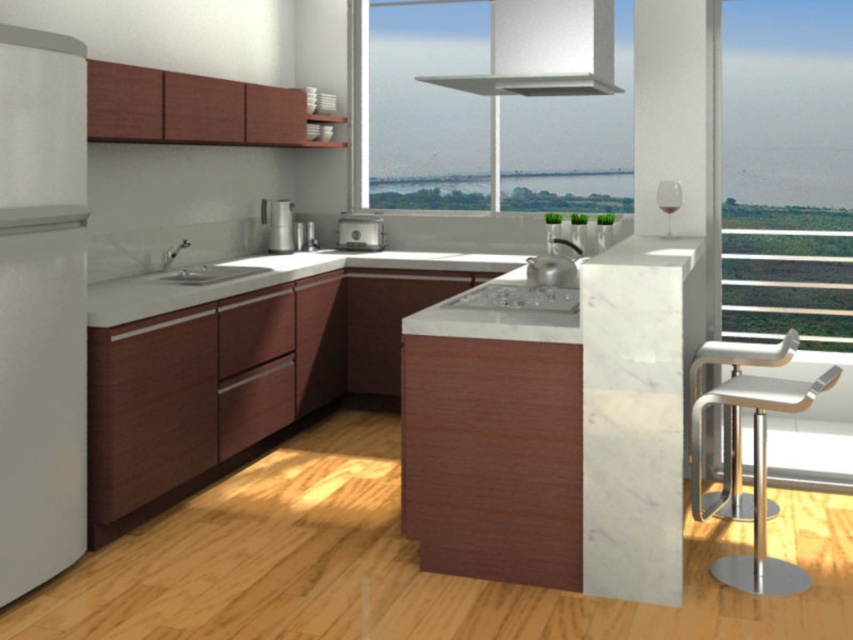
You are standing in the kitchen and want to reach both the point at coordinates point (740, 24) and point (712, 563). Which point should you approach first to reach the closer one?

You should approach point (740, 24) first because it is closer to you than point (712, 563).

You are planning to place a new rectangular table that is 1.2 meters wide between the transparent glass window at upper center and the white leather bar stool at right. Based on the scene description, can the table fit horizontally between these two objects?

The transparent glass window at upper center is wider than the white leather bar stool at right. Since the table is 1.2 meters wide, it depends on the actual width of the space between them. However, the description only states that the window is wider than the stool, but does not provide exact measurements. Therefore, it is uncertain if the table will fit without additional information.

You are standing in the kitchen and want to look outside through the transparent glass window at upper center. To do so, you need to move the metallic silver toaster at center. Where should you move the toaster to so that the window is still visible above it?

The transparent glass window at upper center is positioned over the metallic silver toaster at center, so moving the toaster below the window would keep the window visible above it.